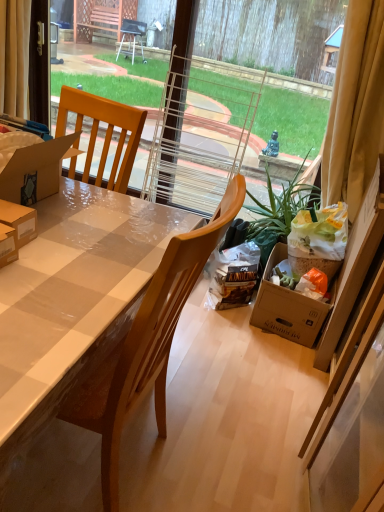
Question: Is yellow fabric curtain at upper right, which ranks as the first curtain in right-to-left order, wider or thinner than wooden chair at center?

Choices:
 (A) thin
 (B) wide

Answer: (A)

Question: Does point (327, 129) appear closer or farther from the camera than point (107, 424)?

Choices:
 (A) closer
 (B) farther

Answer: (B)

Question: Estimate the real-world distances between objects in this image. Which object is farther from the yellow fabric curtain at upper right, marked as the 2th curtain in a left-to-right arrangement?

Choices:
 (A) wooden chair at center
 (B) beige fabric curtain at upper left, the 2th curtain viewed from the right

Answer: (B)

Question: Which object is the farthest from the wooden chair at center?

Choices:
 (A) yellow fabric curtain at upper right, marked as the 2th curtain in a left-to-right arrangement
 (B) beige fabric curtain at upper left, the 2th curtain viewed from the right

Answer: (B)